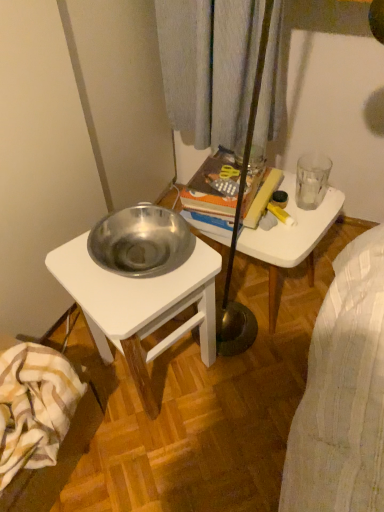
Locate an element on the screen. vacant space in front of white glossy table at upper center is located at coordinates tap(259, 376).